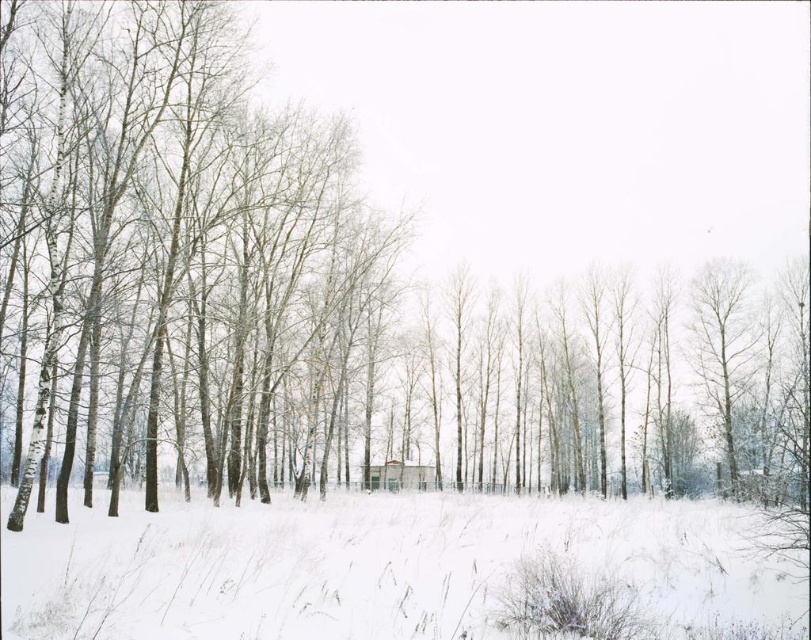
Which of these two, white snow at center or white wooden cabin at center, stands taller?

white snow at center is taller.

Can you confirm if white snow at center is positioned to the right of white wooden cabin at center?

Yes, white snow at center is to the right of white wooden cabin at center.

Where is `white snow at center`? The height and width of the screenshot is (640, 811). white snow at center is located at coordinates (384, 568).